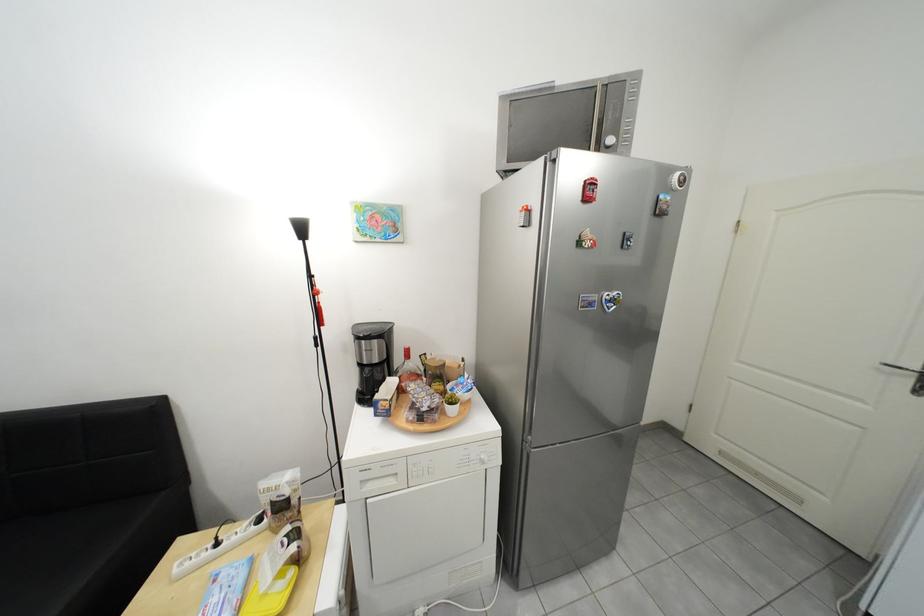
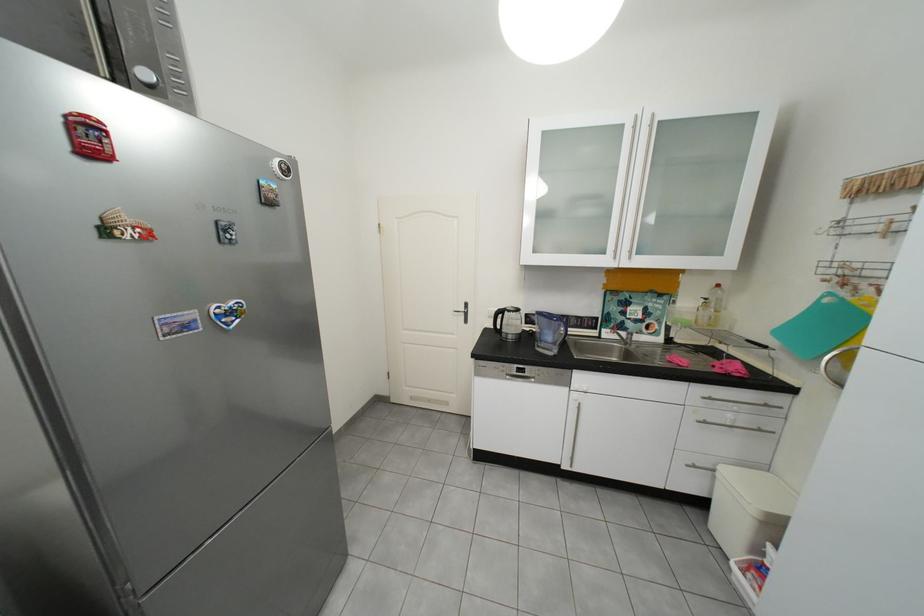
The point at (890, 371) is marked in the first image. Where is the corresponding point in the second image?

(466, 315)